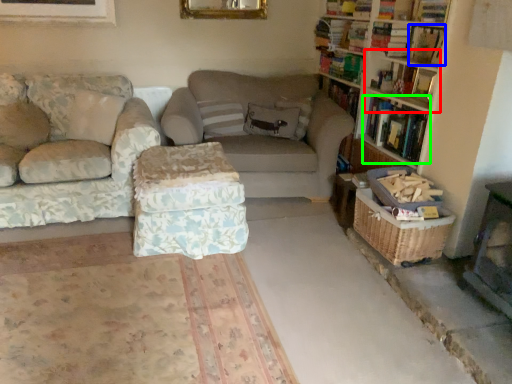
Question: Estimate the real-world distances between objects in this image. Which object is closer to shelf (highlighted by a red box), book (highlighted by a blue box) or book (highlighted by a green box)?

Choices:
 (A) book
 (B) book

Answer: (B)